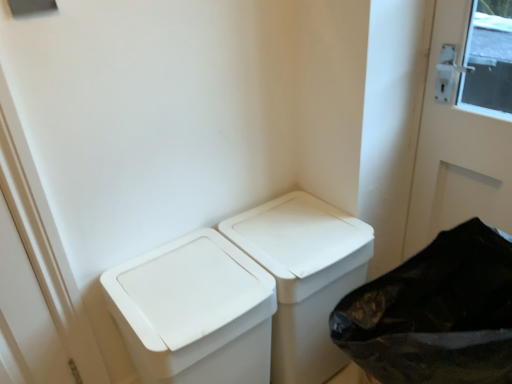
Question: Is there a large distance between white plastic waste container at center, the second waste container viewed from the right, and white plastic recycling bin at lower right?

Choices:
 (A) yes
 (B) no

Answer: (B)

Question: Considering the relative positions of white plastic waste container at center, the first waste container positioned from the left, and white plastic recycling bin at lower right in the image provided, is white plastic waste container at center, the first waste container positioned from the left, to the left of white plastic recycling bin at lower right from the viewer's perspective?

Choices:
 (A) no
 (B) yes

Answer: (B)

Question: From the image's perspective, is white plastic waste container at center, the second waste container viewed from the right, located beneath white plastic recycling bin at lower right?

Choices:
 (A) no
 (B) yes

Answer: (B)

Question: Can you confirm if white plastic waste container at center, the first waste container positioned from the left, is bigger than white plastic recycling bin at lower right?

Choices:
 (A) yes
 (B) no

Answer: (B)

Question: From the image's perspective, does white plastic waste container at center, the second waste container viewed from the right, appear higher than white plastic recycling bin at lower right?

Choices:
 (A) yes
 (B) no

Answer: (B)

Question: In the image, is white plastic recycling bin at lower right on the left side or the right side of white plastic waste container at center, the second waste container viewed from the right?

Choices:
 (A) left
 (B) right

Answer: (B)

Question: Based on their sizes in the image, would you say white plastic recycling bin at lower right is bigger or smaller than white plastic waste container at center, the first waste container positioned from the left?

Choices:
 (A) small
 (B) big

Answer: (B)

Question: From their relative heights in the image, would you say white plastic recycling bin at lower right is taller or shorter than white plastic waste container at center, the first waste container positioned from the left?

Choices:
 (A) tall
 (B) short

Answer: (A)

Question: From a real-world perspective, is white plastic recycling bin at lower right physically located above or below white plastic waste container at center, the second waste container viewed from the right?

Choices:
 (A) below
 (B) above

Answer: (B)

Question: Is white plastic waste container at center, which ranks as the first waste container in right-to-left order, in front of or behind white plastic recycling bin at lower right in the image?

Choices:
 (A) behind
 (B) front

Answer: (A)

Question: From a real-world perspective, is white plastic waste container at center, which is the 2th waste container from left to right, positioned above or below white plastic recycling bin at lower right?

Choices:
 (A) below
 (B) above

Answer: (A)

Question: Is white plastic waste container at center, which is the 2th waste container from left to right, bigger or smaller than white plastic recycling bin at lower right?

Choices:
 (A) small
 (B) big

Answer: (A)

Question: In terms of width, does white plastic waste container at center, which is the 2th waste container from left to right, look wider or thinner when compared to white plastic recycling bin at lower right?

Choices:
 (A) wide
 (B) thin

Answer: (A)

Question: Is white plastic waste container at center, the first waste container positioned from the left, inside the boundaries of white plastic waste container at center, which is the 2th waste container from left to right, or outside?

Choices:
 (A) inside
 (B) outside

Answer: (B)

Question: From a real-world perspective, is white plastic waste container at center, the first waste container positioned from the left, physically located above or below white plastic waste container at center, which ranks as the first waste container in right-to-left order?

Choices:
 (A) below
 (B) above

Answer: (B)